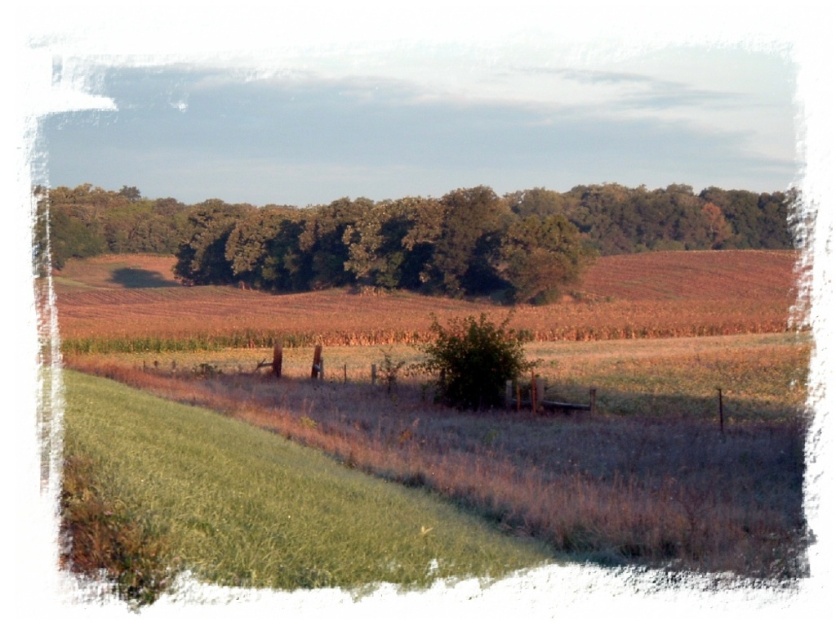
You are a gardener planning to mow the green grass at lower left and the green leafy trees at center. Which area requires more time to mow, considering their sizes?

The green leafy trees at center require more time to mow since their width is greater than the green grass at lower left.

You are standing at the center of the field in the image. If you walk straight towards the point marked at coordinates (266, 499), what type of ground will you encounter first?

The point at coordinates (266, 499) corresponds to green grass at lower left, so you will first encounter green grass at lower left when moving straight from the center of the field.